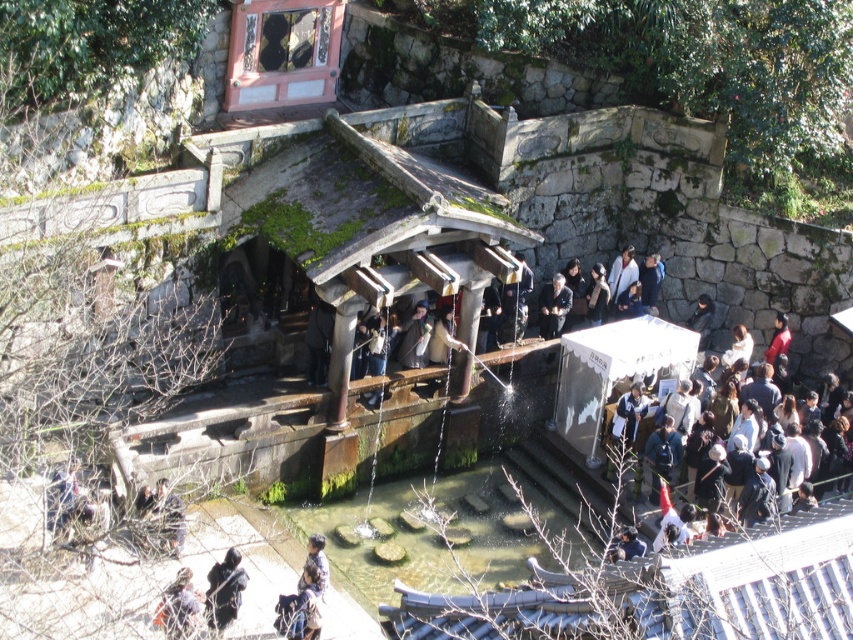
Is dark blue fabric at lower left above dark brown hair at lower left?

Yes, dark blue fabric at lower left is above dark brown hair at lower left.

Between dark blue fabric at lower left and dark brown hair at lower left, which one is positioned lower?

dark brown hair at lower left

Image resolution: width=853 pixels, height=640 pixels. I want to click on dark blue fabric at lower left, so click(x=224, y=589).

Is dark blue fabric at lower left wider than blue denim jacket at lower center?

Yes, dark blue fabric at lower left is wider than blue denim jacket at lower center.

Is dark blue fabric at lower left to the right of blue denim jacket at lower center from the viewer's perspective?

No, dark blue fabric at lower left is not to the right of blue denim jacket at lower center.

Is point (227, 556) closer to camera compared to point (308, 545)?

Yes, it is.

At what (x,y) coordinates should I click in order to perform the action: click on dark blue fabric at lower left. Please return your answer as a coordinate pair (x, y). The image size is (853, 640). Looking at the image, I should click on (224, 589).

Can you confirm if dark gray fabric coat at center is shorter than blue denim jacket at lower center?

No.

Does dark gray fabric coat at center have a lesser width compared to blue denim jacket at lower center?

No.

Does point (326, 305) come closer to viewer compared to point (328, 582)?

That is False.

I want to click on dark gray fabric coat at center, so click(318, 340).